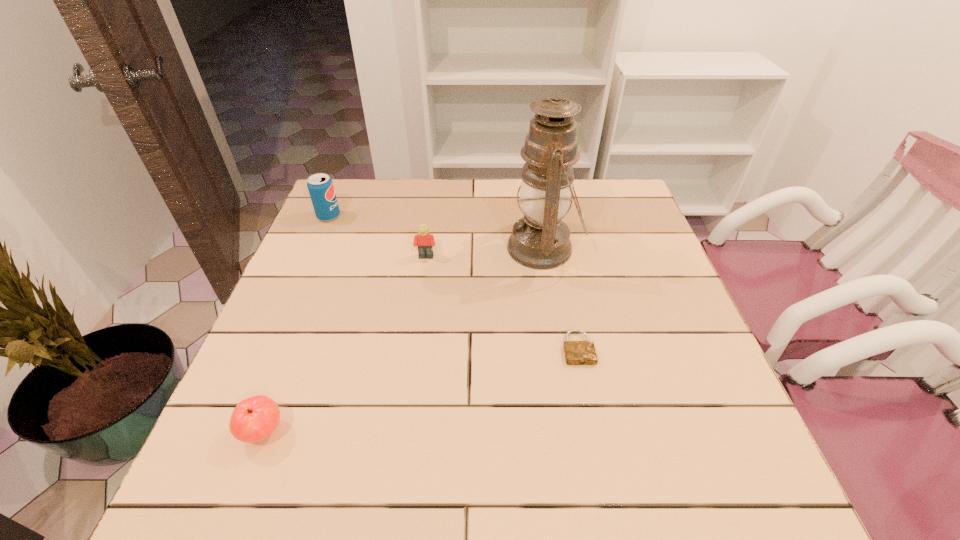
Where is `empty space that is in between the second nearest object and the tallest object`? This screenshot has width=960, height=540. empty space that is in between the second nearest object and the tallest object is located at coordinates (561, 298).

This screenshot has height=540, width=960. Find the location of `vacant space that is in between the Lego and the oil lamp`. vacant space that is in between the Lego and the oil lamp is located at coordinates (485, 253).

You are a GUI agent. You are given a task and a screenshot of the screen. Output one action in this format:
    pyautogui.click(x=<x>, y=<y>)
    Task: Click on the third closest object to the second nearest object
    
    Given the screenshot: What is the action you would take?
    pyautogui.click(x=255, y=418)

What are the coordinates of `the second closest object relative to the padlock` in the screenshot? It's located at (425, 241).